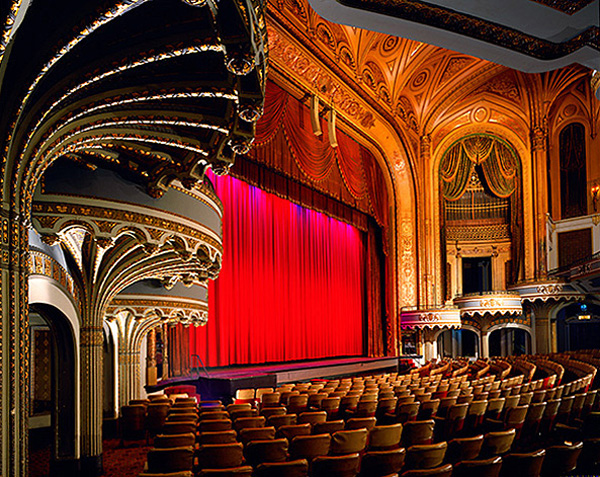
I want to click on pillars, so click(x=15, y=336), click(x=90, y=359), click(x=126, y=362), click(x=482, y=344), click(x=434, y=350), click(x=552, y=338), click(x=497, y=277), click(x=540, y=226).